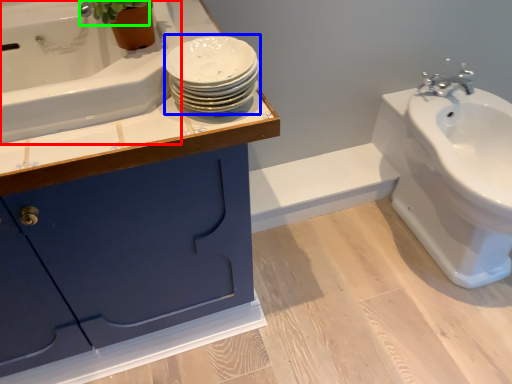
Question: Which object is the farthest from bath (highlighted by a red box)? Choose among these: porcelain (highlighted by a blue box) or plant (highlighted by a green box).

Choices:
 (A) porcelain
 (B) plant

Answer: (A)